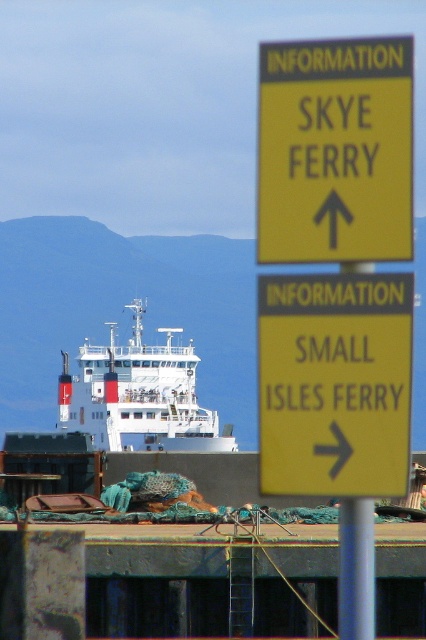
Question: Can you confirm if yellow paper sign at upper center is smaller than yellow paper sign at center?

Choices:
 (A) no
 (B) yes

Answer: (B)

Question: Which point appears farthest from the camera in this image?

Choices:
 (A) (215, 435)
 (B) (271, 230)

Answer: (A)

Question: Is the position of yellow paper sign at upper center less distant than that of yellow paper sign at center?

Choices:
 (A) yes
 (B) no

Answer: (A)

Question: Which point is closer to the camera taking this photo?

Choices:
 (A) (273, 116)
 (B) (327, 410)
 (C) (187, 358)

Answer: (B)

Question: Which point appears closest to the camera in this image?

Choices:
 (A) click(x=305, y=371)
 (B) click(x=348, y=72)
 (C) click(x=92, y=385)

Answer: (B)

Question: Is yellow paper sign at center below white matte ship at center?

Choices:
 (A) no
 (B) yes

Answer: (A)